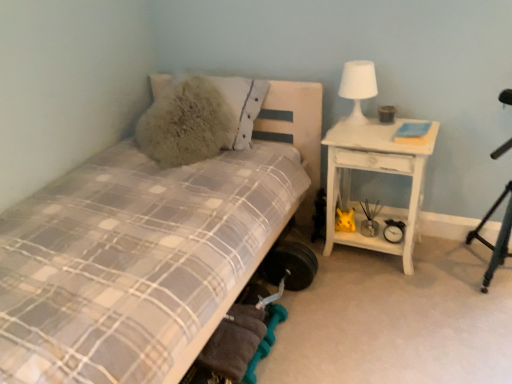
Where is `free space in front of white matte table lamp at upper right`? free space in front of white matte table lamp at upper right is located at coordinates (366, 137).